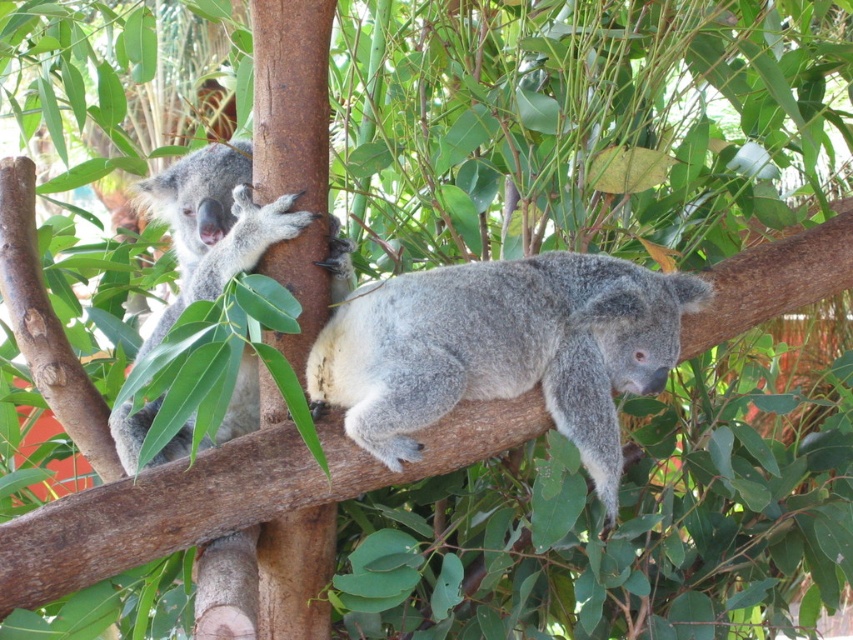
Question: Which point is farther from the camera taking this photo?

Choices:
 (A) (170, 218)
 (B) (495, 298)

Answer: (A)

Question: Does gray furry koala at center appear on the right side of gray furry koala at left?

Choices:
 (A) yes
 (B) no

Answer: (A)

Question: In this image, where is gray furry koala at center located relative to gray furry koala at left?

Choices:
 (A) left
 (B) right

Answer: (B)

Question: Can you confirm if gray furry koala at center is bigger than gray furry koala at left?

Choices:
 (A) no
 (B) yes

Answer: (A)

Question: Which point is closer to the camera taking this photo?

Choices:
 (A) (381, 451)
 (B) (238, 214)

Answer: (A)